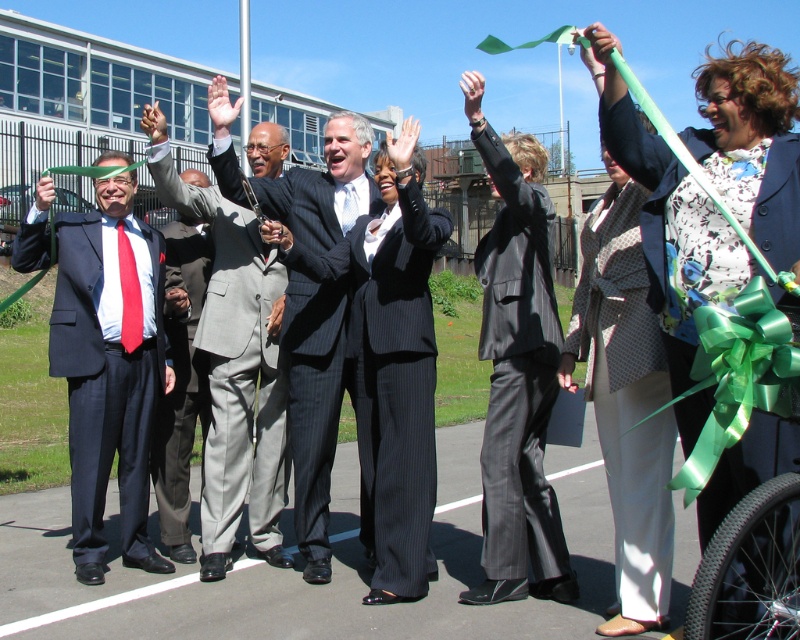
You are attending a ribbon cutting ceremony and want to take a photo of the two people at the center. Which person should you focus on first if you want to capture the black pinstripe suit at center and the white textured pants at center from left to right?

The black pinstripe suit at center is to the left of white textured pants at center, so you should focus on the black pinstripe suit at center first before the white textured pants at center to capture them from left to right.

You are a photographer at the ribbon cutting ceremony. You need to decide which suit is wider between the black leather suit at center and the gray wool suit at center. Which one is wider?

The black leather suit at center is wider than the gray wool suit at center according to the description.